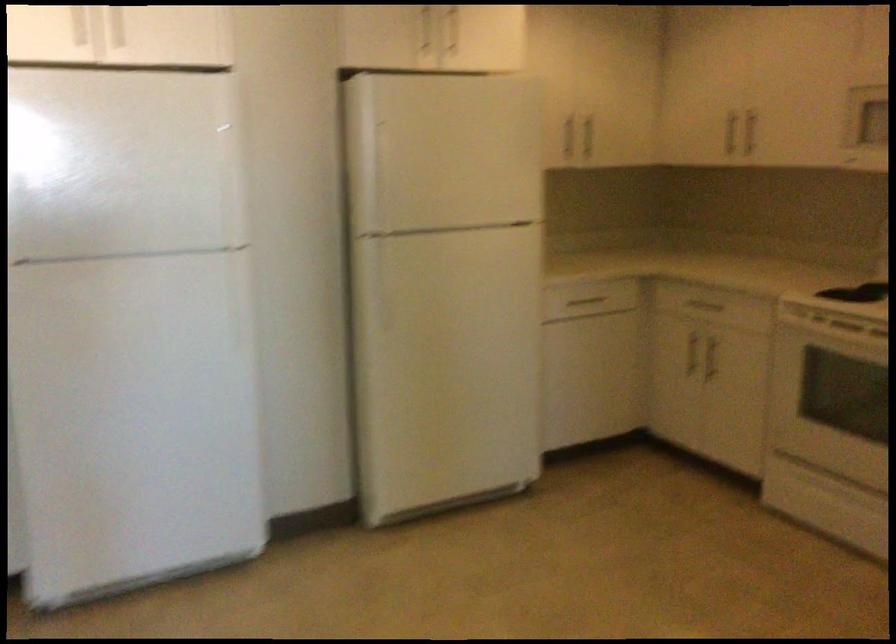
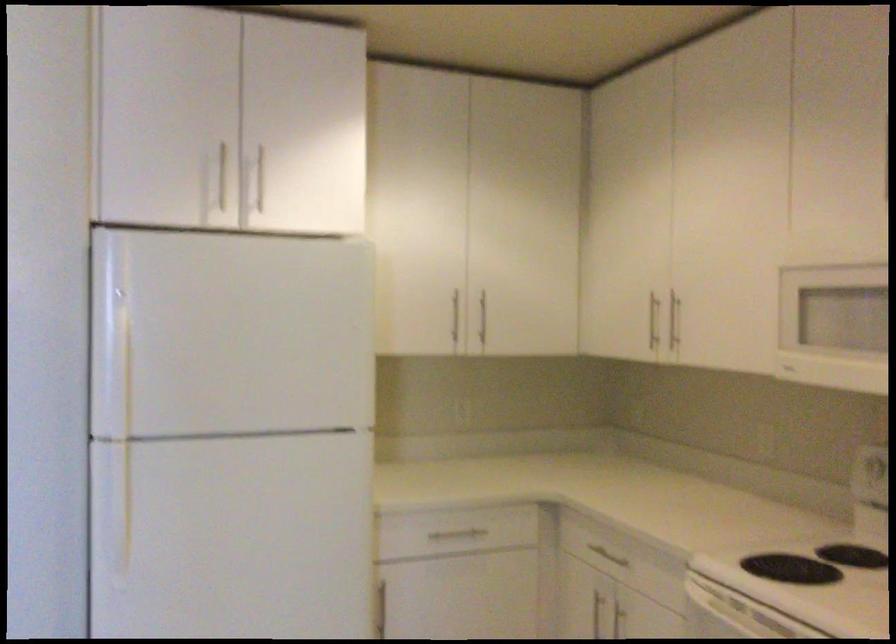
In the second image, find the point that corresponds to point (376, 279) in the first image.

(113, 505)